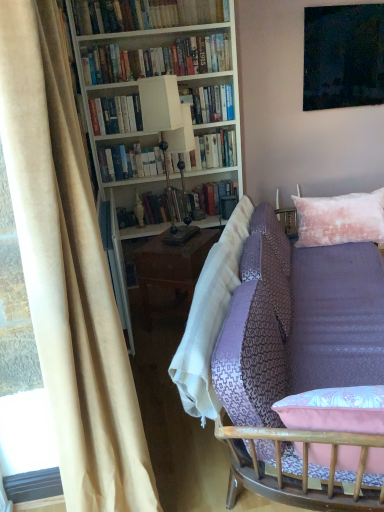
Question: From a real-world perspective, relative to purple fabric couch at lower right, is hardcover books at upper center, which is the 2th book from top to bottom, vertically above or below?

Choices:
 (A) below
 (B) above

Answer: (B)

Question: Considering their positions, is hardcover books at upper center, arranged as the third book when ordered from the bottom, located in front of or behind purple fabric couch at lower right?

Choices:
 (A) front
 (B) behind

Answer: (B)

Question: Which object is the closest to the purple fabric couch at lower right?

Choices:
 (A) hardcover books at upper center, arranged as the third book when ordered from the bottom
 (B) pink textured pillow at upper right
 (C) hardcover book at upper center, placed as the second book when sorted from bottom to top
 (D) beige velvet curtain at left
 (E) white wood bookcase at upper left

Answer: (B)

Question: Considering the real-world distances, which object is farthest from the hardcover books at upper center, placed as the 4th book when sorted from bottom to top?

Choices:
 (A) pink textured pillow at upper right
 (B) white matte lamp at center
 (C) beige velvet curtain at left
 (D) hardcover book at upper center, the third book from the top
 (E) purple fabric couch at lower right

Answer: (C)